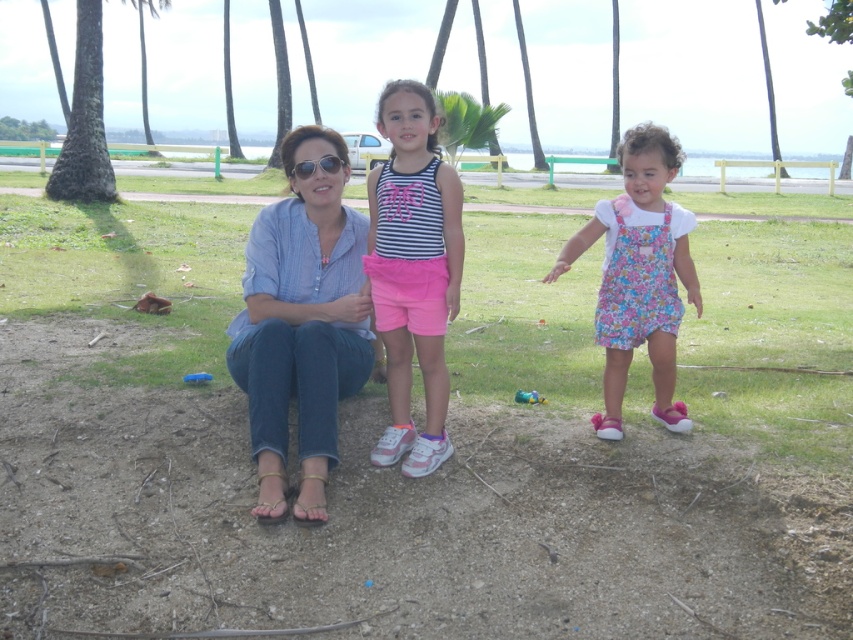
You are standing in the park and see the striped fabric tank top at center and the green leafy palm tree at center. Which object is closer to you?

The striped fabric tank top at center is closer to you because it is positioned under the green leafy palm tree at center, which means the palm tree is further away.

You are standing in the park and see the floral fabric dress at right and the green leafy palm tree at center. Which object is positioned more to the east?

The floral fabric dress at right is positioned more to the east because it is to the right of the green leafy palm tree at center, and in the image, right corresponds to east.

You are standing in the park and see the striped fabric tank top at center and the green leafy palm tree at center. Which object is shorter?

The striped fabric tank top at center is shorter than the green leafy palm tree at center.